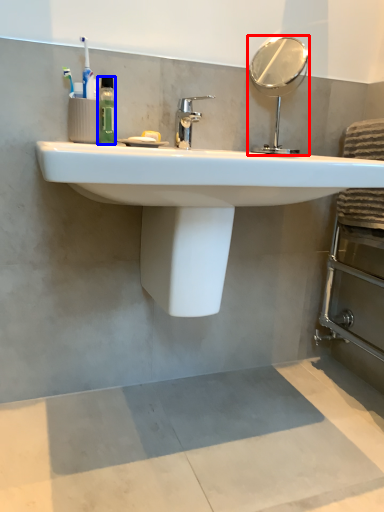
Question: Among these objects, which one is farthest to the camera, mirror (highlighted by a red box) or mouthwash (highlighted by a blue box)?

Choices:
 (A) mirror
 (B) mouthwash

Answer: (A)